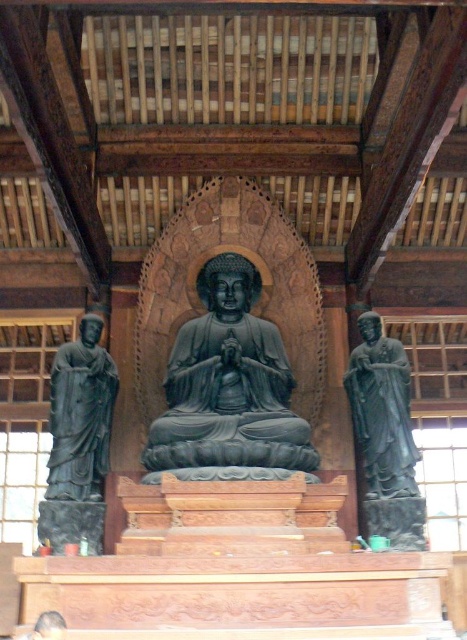
You are a temple visitor standing at the entrance. You want to take a photo of the black stone statue at center and the black polished statue at right. Which statue should you move closer to in order to capture both in the same frame without moving the statues?

Since the black stone statue at center is in front of the black polished statue at right, you should move closer to the black polished statue at right to include both in the frame. By moving closer to the farther statue, you can better align both statues within the camera view.

You are a visitor in the temple and want to place a small offering between the black stone statue at center and the matte black statue at left. Which statue should you stand closer to in order to place the offering between them?

You should stand closer to the matte black statue at left because the black stone statue at center is positioned to its right, so placing the offering between them would require positioning it to the right of the matte black statue at left and to the left of the black stone statue at center.

You are an art student observing the temple interior. You notice the matte black statue at left and the black polished statue at right. Which statue is positioned lower in the temple? Please answer based on their vertical placement.

The matte black statue at left is positioned lower in the temple as it is located below the black polished statue at right.